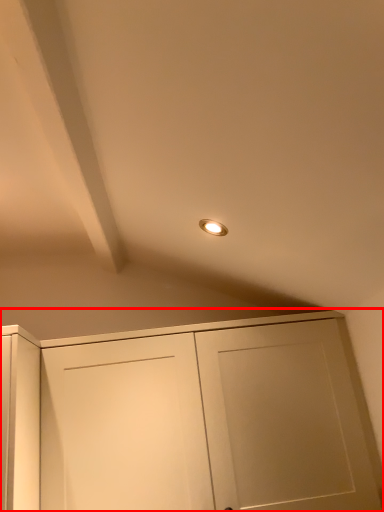
Question: From the image's perspective, where is cupboard (annotated by the red box) located in relation to exhaust hood in the image?

Choices:
 (A) below
 (B) above

Answer: (A)